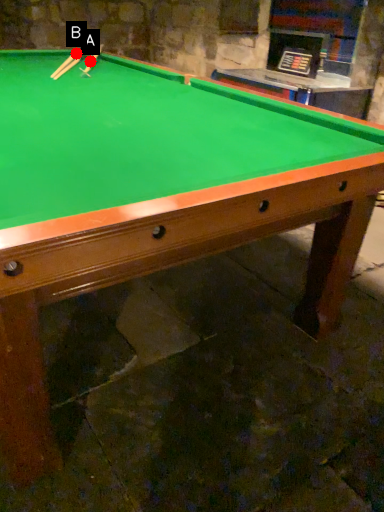
Question: Two points are circled on the image, labeled by A and B beside each circle. Which point appears farthest from the camera in this image?

Choices:
 (A) A is further
 (B) B is further

Answer: (B)